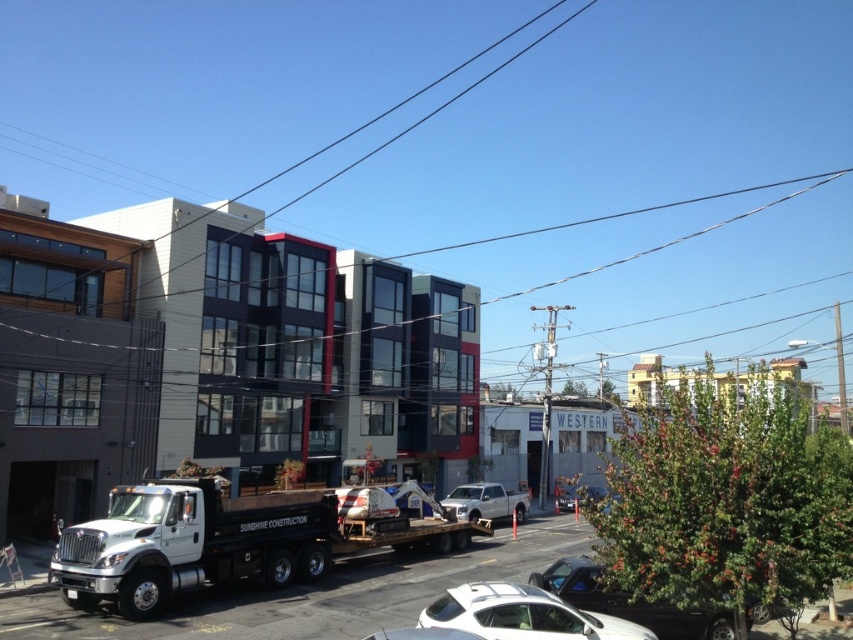
Who is lower down, white matte truck at center or metallic silver sedan at center?

white matte truck at center is below.

Is point (466, 508) farther from camera compared to point (567, 493)?

No.

Identify the location of white matte truck at center. The height and width of the screenshot is (640, 853). (485, 500).

Who is positioned more to the left, white matte suv at center or metallic silver sedan at center?

white matte suv at center

Which is behind, point (511, 595) or point (567, 508)?

Point (567, 508)

Where is `white matte suv at center`? white matte suv at center is located at coordinates [x=521, y=614].

Does white matte tow truck at lower left appear over metallic silver sedan at lower center?

Incorrect, white matte tow truck at lower left is not positioned above metallic silver sedan at lower center.

What do you see at coordinates (218, 541) in the screenshot?
I see `white matte tow truck at lower left` at bounding box center [218, 541].

Is point (300, 547) less distant than point (747, 627)?

No, it is not.

Find the location of `white matte tow truck at lower left`. white matte tow truck at lower left is located at coordinates (218, 541).